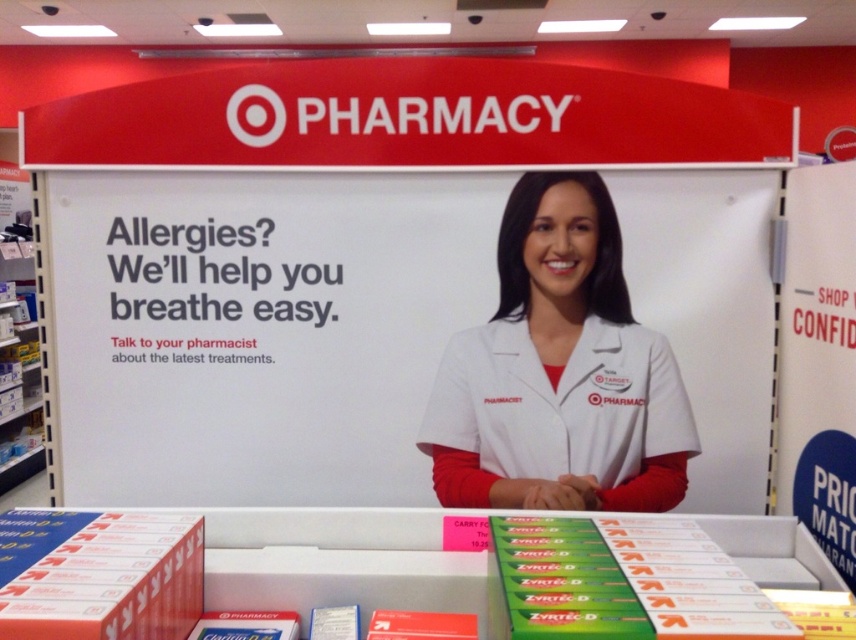
Question: Observing the image, what is the correct spatial positioning of white paperboard at center in reference to white smooth coat at center?

Choices:
 (A) above
 (B) below

Answer: (A)

Question: Can you confirm if white paperboard at center is positioned to the left of white smooth coat at center?

Choices:
 (A) no
 (B) yes

Answer: (B)

Question: Which of the following is the closest to the observer?

Choices:
 (A) (476, 392)
 (B) (727, 179)

Answer: (B)

Question: Is white paperboard at center smaller than white smooth coat at center?

Choices:
 (A) no
 (B) yes

Answer: (A)

Question: Which object is farther from the camera taking this photo?

Choices:
 (A) white paperboard at center
 (B) white smooth coat at center

Answer: (A)